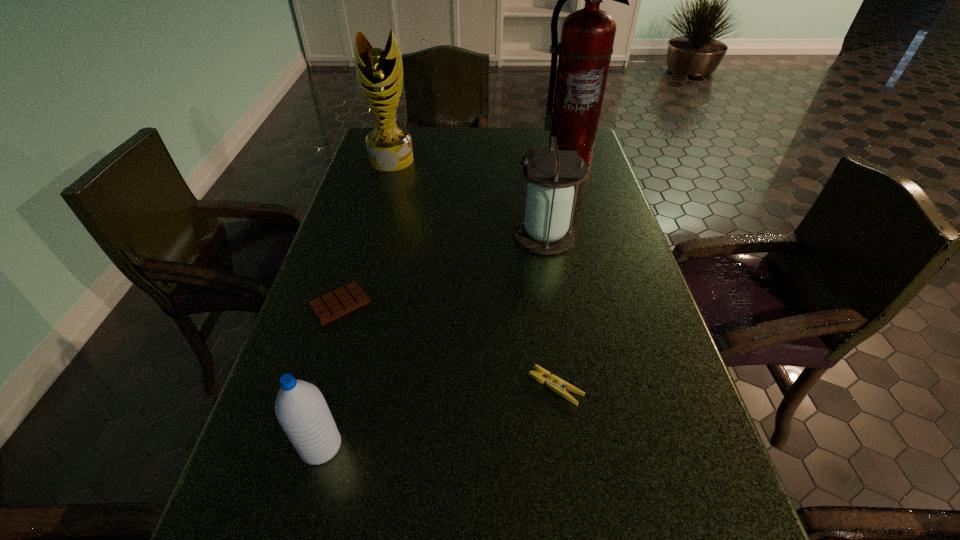
Locate an element on the screen. Image resolution: width=960 pixels, height=540 pixels. blank space located 0.150m on the front of the fourth shortest object is located at coordinates (555, 300).

Find the location of a particular element. The width and height of the screenshot is (960, 540). free space located on the right of the fourth tallest object is located at coordinates pyautogui.click(x=496, y=446).

Where is `vacant space situated on the back of the fourth farthest object`? vacant space situated on the back of the fourth farthest object is located at coordinates (356, 251).

Find the location of `free spot located on the back of the clothespin`. free spot located on the back of the clothespin is located at coordinates (540, 272).

Locate an element on the screen. The width and height of the screenshot is (960, 540). fire extinguisher present at the far edge is located at coordinates (587, 38).

Identify the location of award that is at the far edge. Image resolution: width=960 pixels, height=540 pixels. (379, 72).

This screenshot has width=960, height=540. What are the coordinates of `award that is positioned at the left edge` in the screenshot? It's located at (379, 72).

Locate an element on the screen. The image size is (960, 540). water bottle located at the left edge is located at coordinates (301, 409).

Find the location of a particular element. This screenshot has width=960, height=540. candy bar present at the left edge is located at coordinates (343, 300).

Find the location of a particular element. The image size is (960, 540). fire extinguisher that is at the right edge is located at coordinates (587, 38).